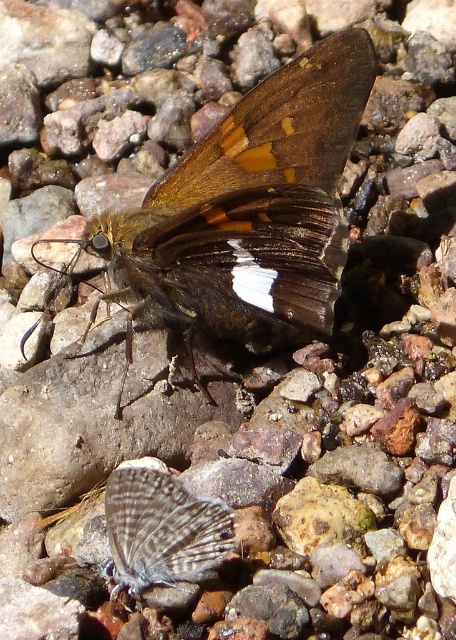
Does brown matte wing at center have a greater width compared to speckled gray butterfly at center?

Yes, brown matte wing at center is wider than speckled gray butterfly at center.

Consider the image. Which of these two, brown matte wing at center or speckled gray butterfly at center, stands taller?

brown matte wing at center

Is point (276, 182) behind point (123, 522)?

Yes, point (276, 182) is behind point (123, 522).

Where is `brown matte wing at center`? This screenshot has width=456, height=640. brown matte wing at center is located at coordinates (280, 128).

Can you confirm if shiny brown butterfly at center is shorter than speckled gray butterfly at center?

Incorrect, shiny brown butterfly at center's height does not fall short of speckled gray butterfly at center's.

Does shiny brown butterfly at center have a greater width compared to speckled gray butterfly at center?

Correct, the width of shiny brown butterfly at center exceeds that of speckled gray butterfly at center.

Does point (331, 195) lie in front of point (161, 493)?

No.

Image resolution: width=456 pixels, height=640 pixels. Find the location of `shiny brown butterfly at center`. shiny brown butterfly at center is located at coordinates (247, 212).

Measure the distance between point (161, 193) and camera.

They are 1.19 meters apart.

Does shiny brown butterfly at center appear over brown matte wing at center?

No.

Who is more forward, (x=229, y=192) or (x=248, y=186)?

Point (x=229, y=192)

Where is `shiny brown butterfly at center`? The width and height of the screenshot is (456, 640). shiny brown butterfly at center is located at coordinates (247, 212).